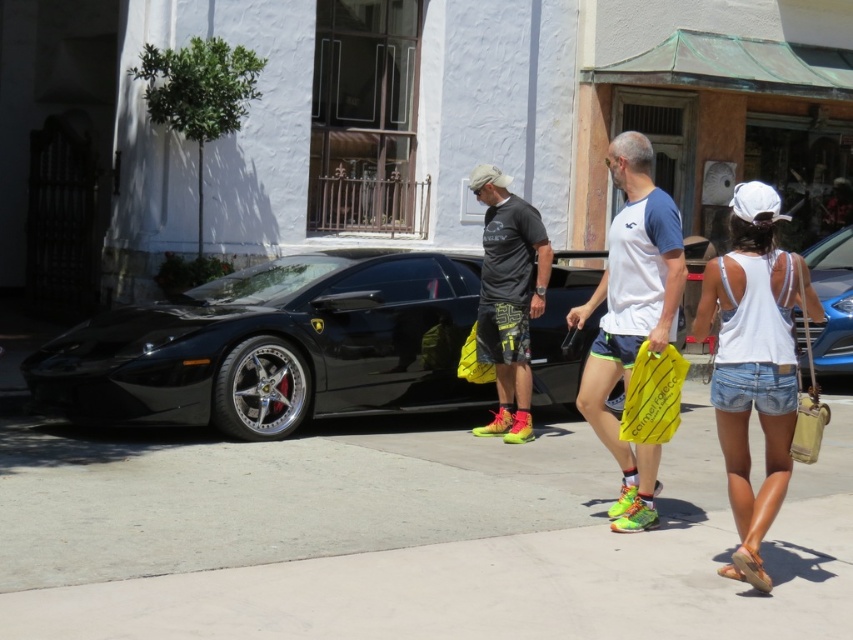
Locate an element on the screen. This screenshot has height=640, width=853. shiny black sports car at center-left is located at coordinates coord(274,346).

What do you see at coordinates (753, 362) in the screenshot? Image resolution: width=853 pixels, height=640 pixels. I see `white cotton tank top at center` at bounding box center [753, 362].

I want to click on white cotton tank top at center, so click(753, 362).

The width and height of the screenshot is (853, 640). Find the location of `matte black t-shirt at center`. matte black t-shirt at center is located at coordinates (508, 298).

Is matte black t-shirt at center closer to camera compared to yellow plastic bag at center?

No, it is not.

Does point (482, 172) come farther from viewer compared to point (628, 435)?

Yes.

Identify the location of matte black t-shirt at center. (508, 298).